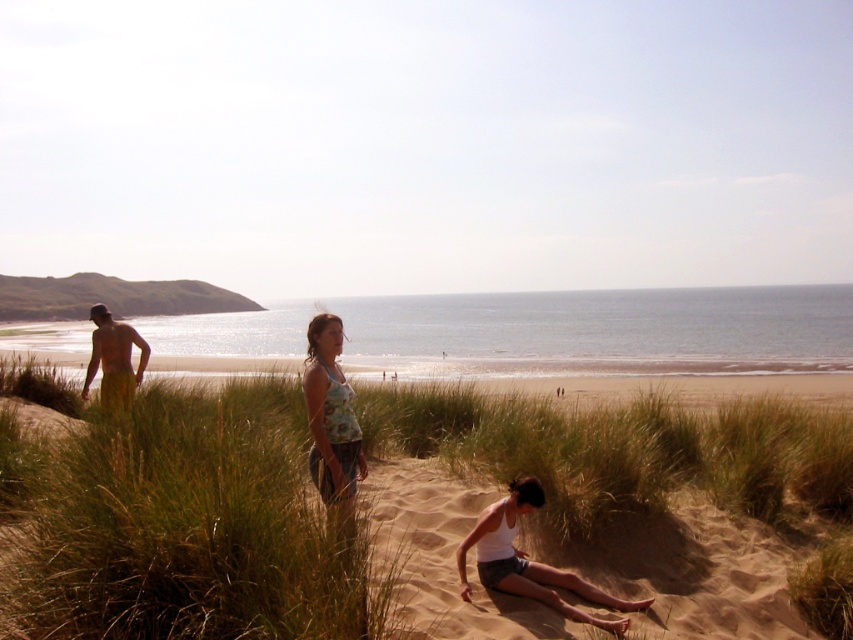
Question: Which object appears farthest from the camera in this image?

Choices:
 (A) floral tank top at center
 (B) sandy tan sand at lower center
 (C) white cotton tank top at lower center
 (D) green grass at center

Answer: (B)

Question: Which point is closer to the camera?

Choices:
 (A) white cotton tank top at lower center
 (B) green grass at center
 (C) yellow shorts at left

Answer: (B)

Question: Does floral tank top at center appear on the right side of white cotton tank top at lower center?

Choices:
 (A) yes
 (B) no

Answer: (B)

Question: Does floral tank top at center have a larger size compared to white cotton tank top at lower center?

Choices:
 (A) yes
 (B) no

Answer: (B)

Question: Which object is farther from the camera taking this photo?

Choices:
 (A) sandy tan sand at lower center
 (B) yellow shorts at left

Answer: (B)

Question: Is sandy tan sand at lower center closer to camera compared to beige sand at center?

Choices:
 (A) yes
 (B) no

Answer: (A)